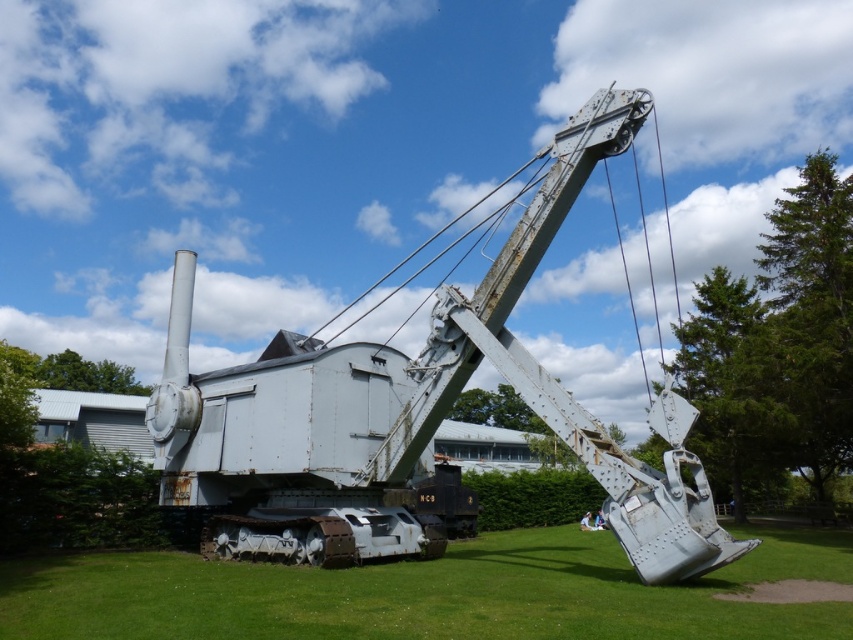
Question: Which point is farther to the camera?

Choices:
 (A) (675, 532)
 (B) (537, 582)

Answer: (B)

Question: Is rusty metal excavator at center positioned in front of green grass at lower center?

Choices:
 (A) yes
 (B) no

Answer: (B)

Question: Where is rusty metal excavator at center located in relation to green grass at lower center in the image?

Choices:
 (A) below
 (B) above

Answer: (B)

Question: Which object is farther from the camera taking this photo?

Choices:
 (A) green grass at lower center
 (B) rusty metal excavator at center

Answer: (B)

Question: Does rusty metal excavator at center appear on the right side of green grass at lower center?

Choices:
 (A) no
 (B) yes

Answer: (A)

Question: Which point appears closest to the camera in this image?

Choices:
 (A) (531, 259)
 (B) (584, 602)

Answer: (B)